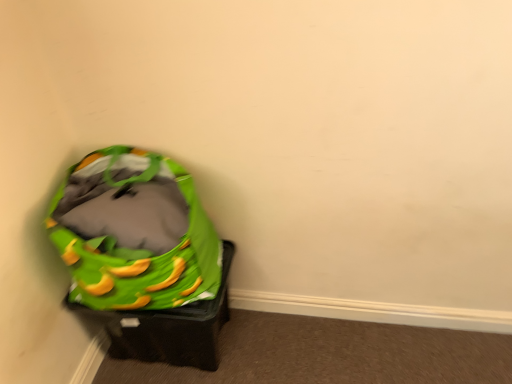
Question: Is green fabric bean bag chair at left wider or thinner than green fabric bag at lower left?

Choices:
 (A) thin
 (B) wide

Answer: (B)

Question: Considering the positions of green fabric bean bag chair at left and green fabric bag at lower left in the image, is green fabric bean bag chair at left taller or shorter than green fabric bag at lower left?

Choices:
 (A) tall
 (B) short

Answer: (A)

Question: From a real-world perspective, is green fabric bean bag chair at left above or below green fabric bag at lower left?

Choices:
 (A) below
 (B) above

Answer: (B)

Question: From a real-world perspective, relative to green fabric bean bag chair at left, is green fabric bag at lower left vertically above or below?

Choices:
 (A) below
 (B) above

Answer: (A)

Question: Which is correct: green fabric bag at lower left is inside green fabric bean bag chair at left, or outside of it?

Choices:
 (A) inside
 (B) outside

Answer: (B)

Question: In terms of height, does green fabric bag at lower left look taller or shorter compared to green fabric bean bag chair at left?

Choices:
 (A) tall
 (B) short

Answer: (B)

Question: Is green fabric bag at lower left bigger or smaller than green fabric bean bag chair at left?

Choices:
 (A) big
 (B) small

Answer: (B)